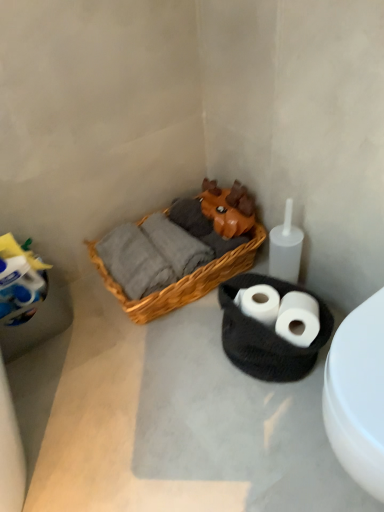
Question: From the image's perspective, is woven wood picnic basket at center located beneath white matte toilet at lower right?

Choices:
 (A) no
 (B) yes

Answer: (A)

Question: Could you tell me if woven wood picnic basket at center is facing white matte toilet at lower right?

Choices:
 (A) no
 (B) yes

Answer: (A)

Question: Is woven wood picnic basket at center to the right of white matte toilet at lower right from the viewer's perspective?

Choices:
 (A) no
 (B) yes

Answer: (A)

Question: Is woven wood picnic basket at center wider than white matte toilet at lower right?

Choices:
 (A) yes
 (B) no

Answer: (A)

Question: From the image's perspective, is woven wood picnic basket at center on top of white matte toilet at lower right?

Choices:
 (A) yes
 (B) no

Answer: (A)

Question: Can you confirm if woven wood picnic basket at center is bigger than white matte toilet at lower right?

Choices:
 (A) yes
 (B) no

Answer: (A)

Question: Is white matte toilet paper at lower right, which is counted as the 1th toilet paper, starting from the right, taller than white matte toilet paper at center, the 1th toilet paper from the left?

Choices:
 (A) yes
 (B) no

Answer: (A)

Question: Can we say white matte toilet paper at lower right, the 2th toilet paper in the left-to-right sequence, lies outside white matte toilet paper at center, the 1th toilet paper from the left?

Choices:
 (A) no
 (B) yes

Answer: (B)

Question: Is white matte toilet paper at lower right, which is counted as the 1th toilet paper, starting from the right, not near white matte toilet paper at center, the second toilet paper positioned from the right?

Choices:
 (A) yes
 (B) no

Answer: (B)

Question: Can you confirm if white matte toilet paper at lower right, the 2th toilet paper in the left-to-right sequence, is positioned to the right of white matte toilet paper at center, the second toilet paper positioned from the right?

Choices:
 (A) yes
 (B) no

Answer: (A)

Question: Is white matte toilet paper at lower right, which is counted as the 1th toilet paper, starting from the right, at the left side of white matte toilet paper at center, the second toilet paper positioned from the right?

Choices:
 (A) yes
 (B) no

Answer: (B)

Question: From a real-world perspective, is white matte toilet paper at lower right, which is counted as the 1th toilet paper, starting from the right, on top of white matte toilet paper at center, the 1th toilet paper from the left?

Choices:
 (A) no
 (B) yes

Answer: (B)

Question: Considering the relative sizes of white matte toilet paper at center, the 1th toilet paper from the left, and white matte toilet paper at lower right, which is counted as the 1th toilet paper, starting from the right, in the image provided, is white matte toilet paper at center, the 1th toilet paper from the left, wider than white matte toilet paper at lower right, which is counted as the 1th toilet paper, starting from the right,?

Choices:
 (A) yes
 (B) no

Answer: (B)